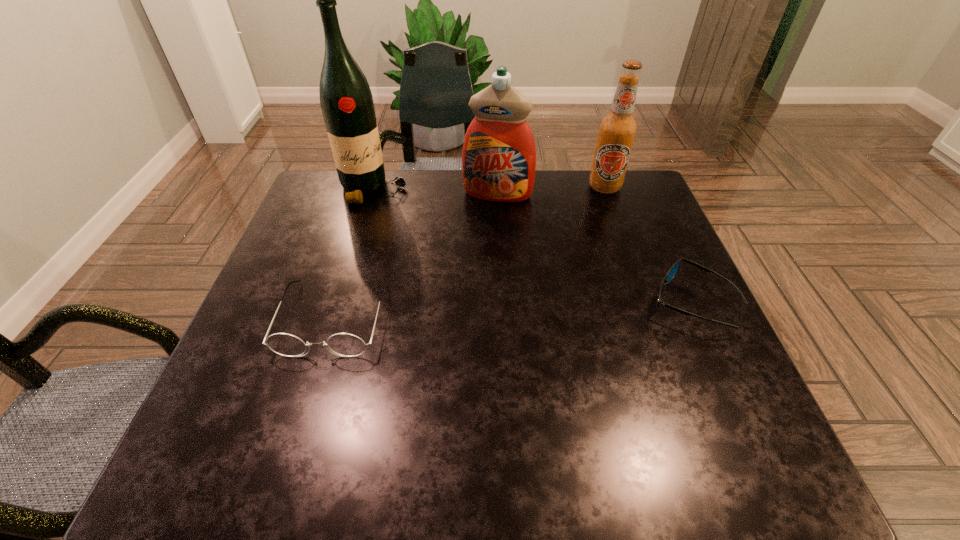
Where is `spectacles`? The width and height of the screenshot is (960, 540). spectacles is located at coordinates (344, 344).

In order to click on sunglasses in this screenshot , I will do `click(672, 272)`.

The width and height of the screenshot is (960, 540). Find the location of `the third object from right to left`. the third object from right to left is located at coordinates (499, 157).

This screenshot has height=540, width=960. Find the location of `the tallest object`. the tallest object is located at coordinates (346, 101).

Where is `beer bottle`? This screenshot has height=540, width=960. beer bottle is located at coordinates (617, 130).

The image size is (960, 540). I want to click on vacant space located on the front-facing side of the fourth tallest object, so click(308, 402).

Find the location of a particular element. This screenshot has width=960, height=540. vacant position located 0.160m at the front of the sunglasses showing the lenses is located at coordinates (574, 302).

You are a GUI agent. You are given a task and a screenshot of the screen. Output one action in this format:
    pyautogui.click(x=<x>, y=<y>)
    Task: Click on the vacant space situated 0.150m at the front of the sunglasses showing the lenses
    The height and width of the screenshot is (540, 960).
    Given the screenshot: What is the action you would take?
    (579, 302)

The image size is (960, 540). What are the coordinates of `free space located at the front of the sunglasses showing the lenses` in the screenshot? It's located at (592, 302).

The image size is (960, 540). Identify the location of vacant space situated 0.320m on the front surface of the third object from left to right. (473, 286).